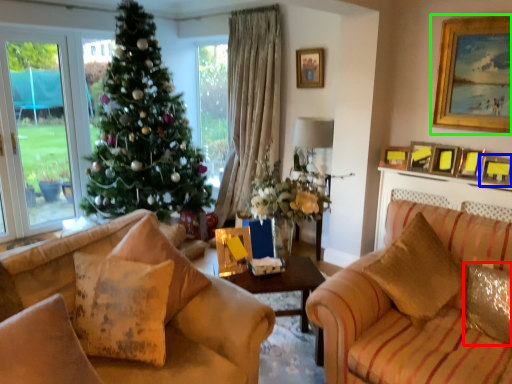
Question: Which is nearer to the pillow (highlighted by a red box)? picture frame (highlighted by a blue box) or picture frame (highlighted by a green box).

Choices:
 (A) picture frame
 (B) picture frame

Answer: (A)